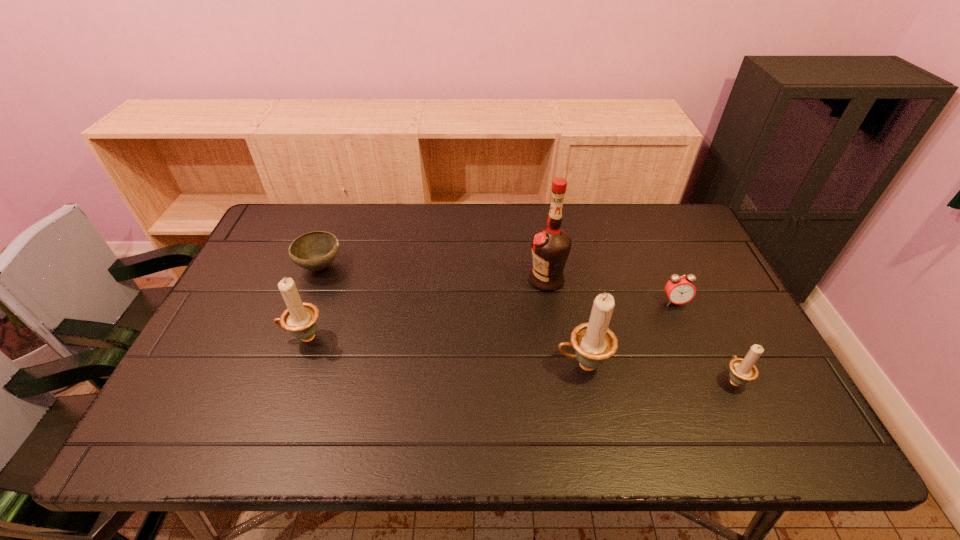
Find the location of `free region that satisfies the following two spatial constraints: 1. on the handle side of the third shortest object; 2. on the handle side of the second candle_holder from left to right`. free region that satisfies the following two spatial constraints: 1. on the handle side of the third shortest object; 2. on the handle side of the second candle_holder from left to right is located at coordinates (727, 365).

Image resolution: width=960 pixels, height=540 pixels. I want to click on vacant area in the image that satisfies the following two spatial constraints: 1. on the handle side of the rightmost candle_holder; 2. on the front and back of the tallest object, so click(x=685, y=280).

Image resolution: width=960 pixels, height=540 pixels. Identify the location of free space that satisfies the following two spatial constraints: 1. on the front-facing side of the alarm clock; 2. on the handle side of the fourth shortest object. (690, 338).

The image size is (960, 540). What are the coordinates of `free location that satisfies the following two spatial constraints: 1. on the front and back of the tallest object; 2. on the handle side of the fourth tallest object` in the screenshot? It's located at (562, 380).

The width and height of the screenshot is (960, 540). Find the location of `vacant space that satisfies the following two spatial constraints: 1. on the front-facing side of the alarm clock; 2. on the handle side of the leftmost candle_holder`. vacant space that satisfies the following two spatial constraints: 1. on the front-facing side of the alarm clock; 2. on the handle side of the leftmost candle_holder is located at coordinates (690, 338).